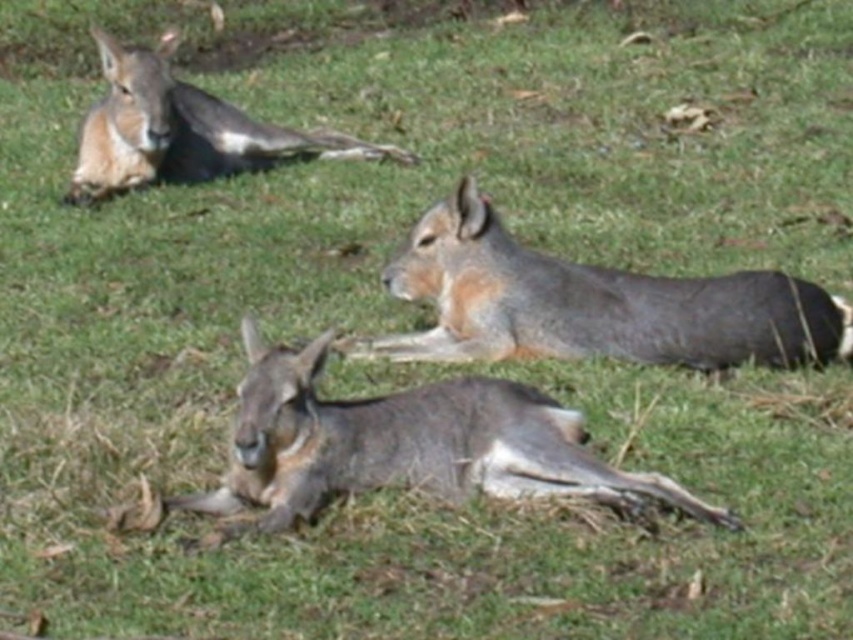
Is point (370, 444) in front of point (717, 324)?

Yes, point (370, 444) is closer to viewer.

Can you confirm if gray fur kangaroo at lower center is thinner than gray fur rabbit at center?

Correct, gray fur kangaroo at lower center's width is less than gray fur rabbit at center's.

Does point (248, 470) come in front of point (448, 330)?

That is True.

At what (x,y) coordinates should I click in order to perform the action: click on gray fur kangaroo at lower center. Please return your answer as a coordinate pair (x, y). Looking at the image, I should click on (408, 444).

Can you confirm if gray fur rabbit at center is thinner than gray fur kangaroo at upper left?

No.

Does gray fur rabbit at center appear on the right side of gray fur kangaroo at upper left?

Indeed, gray fur rabbit at center is positioned on the right side of gray fur kangaroo at upper left.

In order to click on gray fur rabbit at center in this screenshot , I will do `click(589, 304)`.

Who is positioned more to the left, gray fur kangaroo at lower center or gray fur kangaroo at upper left?

From the viewer's perspective, gray fur kangaroo at upper left appears more on the left side.

Does gray fur kangaroo at lower center appear on the left side of gray fur kangaroo at upper left?

Incorrect, gray fur kangaroo at lower center is not on the left side of gray fur kangaroo at upper left.

Find the location of `gray fur kangaroo at lower center`. gray fur kangaroo at lower center is located at coordinates click(x=408, y=444).